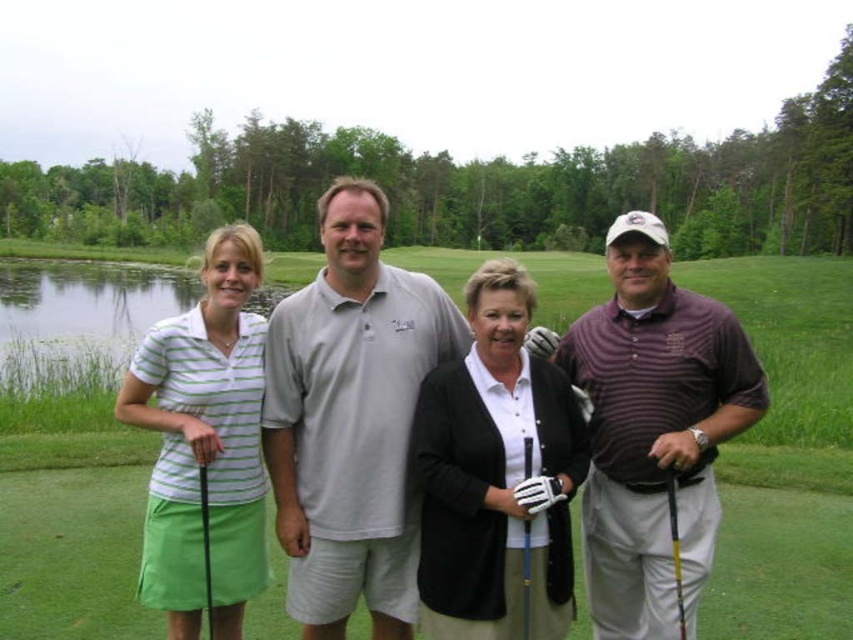
Question: Which point is closer to the camera?

Choices:
 (A) (676, 536)
 (B) (701, 570)
 (C) (780, 557)
 (D) (238, 339)

Answer: (A)

Question: Among these points, which one is nearest to the camera?

Choices:
 (A) (701, 412)
 (B) (206, 536)
 (C) (532, 448)

Answer: (C)

Question: Does green grass at center have a larger size compared to green matte golf club at lower left?

Choices:
 (A) yes
 (B) no

Answer: (A)

Question: Can you confirm if green grass at center is positioned below striped cotton polo shirt at center?

Choices:
 (A) yes
 (B) no

Answer: (B)

Question: Which of the following is the farthest from the observer?

Choices:
 (A) (848, 321)
 (B) (430, 516)
 (C) (282, 468)
 (D) (714, 486)

Answer: (A)

Question: Does green grass at center appear under gray cotton polo shirt at center?

Choices:
 (A) no
 (B) yes

Answer: (A)